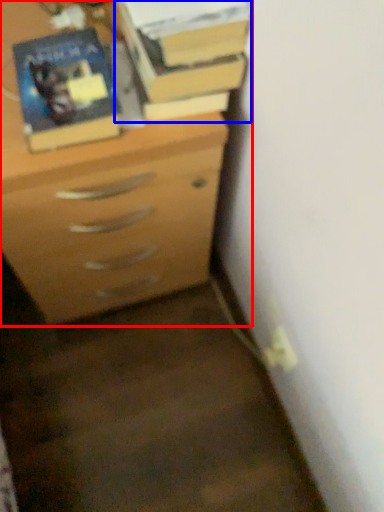
Question: Which object is further to the camera taking this photo, chest of drawers (highlighted by a red box) or book (highlighted by a blue box)?

Choices:
 (A) chest of drawers
 (B) book

Answer: (B)